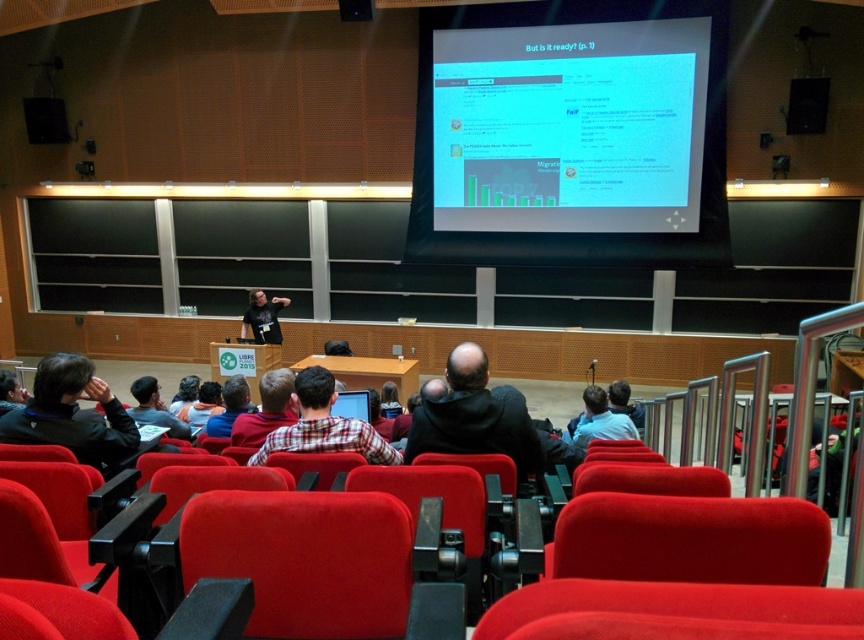
Question: Does dark blue hoodie at lower left appear under matte black shirt at center?

Choices:
 (A) yes
 (B) no

Answer: (A)

Question: Which is farther from the white glossy projector screen at upper center?

Choices:
 (A) velvet red seat at lower left
 (B) red fabric chair at center
 (C) velvet red seat at center

Answer: (A)

Question: Estimate the real-world distances between objects in this image. Which object is farther from the matte black shirt at center?

Choices:
 (A) dark blue hoodie at lower left
 (B) red fabric chair at center

Answer: (B)

Question: Which object appears closest to the camera in this image?

Choices:
 (A) velvet red chair at center
 (B) dark blue hoodie at lower left
 (C) matte red chair at lower center

Answer: (C)

Question: Does velvet red chair at center appear on the right side of dark blue hoodie at lower left?

Choices:
 (A) yes
 (B) no

Answer: (A)

Question: Where is white glossy projector screen at upper center located in relation to dark gray hoodie at center in the image?

Choices:
 (A) below
 (B) above

Answer: (B)